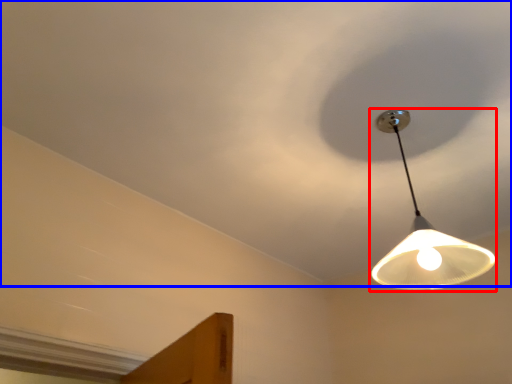
Question: Which of the following is the farthest to the observer, lamp (highlighted by a red box) or cloud (highlighted by a blue box)?

Choices:
 (A) lamp
 (B) cloud

Answer: (A)